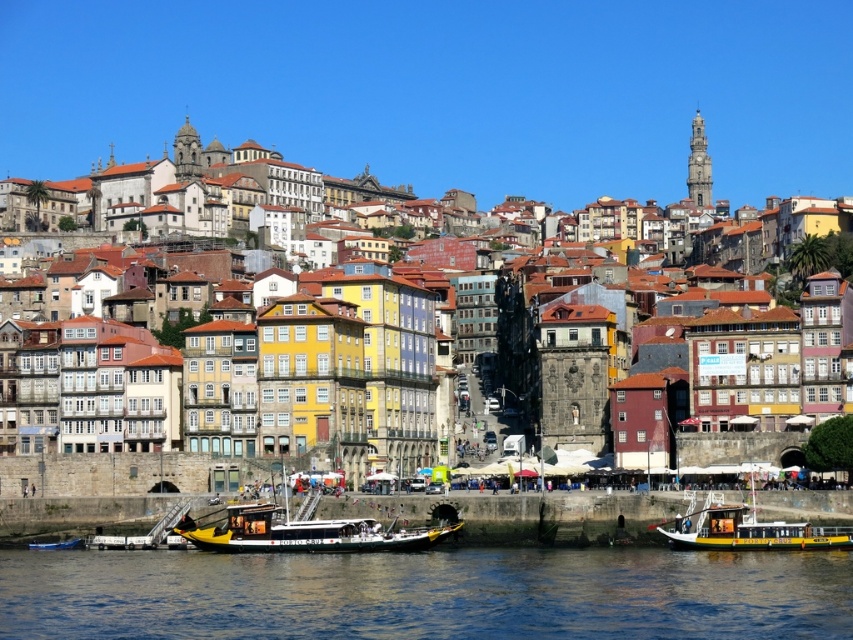
Question: Can you confirm if multicolored stone buildings at lower left is positioned to the left of yellow-green wooden boat at lower center?

Choices:
 (A) yes
 (B) no

Answer: (B)

Question: Is blue water at lower center to the right of multicolored stone buildings at lower left from the viewer's perspective?

Choices:
 (A) yes
 (B) no

Answer: (B)

Question: Which object is farther from the camera taking this photo?

Choices:
 (A) yellow matte boat at lower right
 (B) blue water at lower center
 (C) blue painted wooden boat at lower left

Answer: (C)

Question: Is yellow-green wooden boat at lower center bigger than yellow matte boat at lower right?

Choices:
 (A) no
 (B) yes

Answer: (A)

Question: Among these objects, which one is farthest from the camera?

Choices:
 (A) blue painted wooden boat at lower left
 (B) yellow-green wooden boat at lower center
 (C) multicolored stone buildings at lower left

Answer: (C)

Question: Which point appears farthest from the camera in this image?

Choices:
 (A) (263, 608)
 (B) (849, 525)
 (C) (41, 547)
 (D) (680, 227)

Answer: (D)